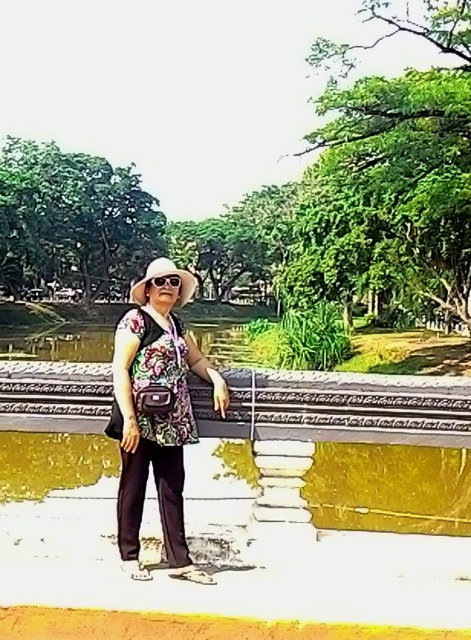
Question: Which of the following is the closest to the observer?

Choices:
 (A) sunglasses at center
 (B) floral fabric blouse at center
 (C) metallic polished rail at center

Answer: (B)

Question: Does floral fabric blouse at center have a greater width compared to metallic polished rail at center?

Choices:
 (A) no
 (B) yes

Answer: (A)

Question: Based on their relative distances, which object is farther from the floral fabric blouse at center?

Choices:
 (A) sunglasses at center
 (B) metallic polished rail at center

Answer: (B)

Question: Estimate the real-world distances between objects in this image. Which object is farther from the floral fabric blouse at center?

Choices:
 (A) metallic polished rail at center
 (B) sunglasses at center

Answer: (A)

Question: Can you confirm if floral fabric blouse at center is positioned above metallic polished rail at center?

Choices:
 (A) no
 (B) yes

Answer: (A)

Question: Is metallic polished rail at center wider than sunglasses at center?

Choices:
 (A) yes
 (B) no

Answer: (A)